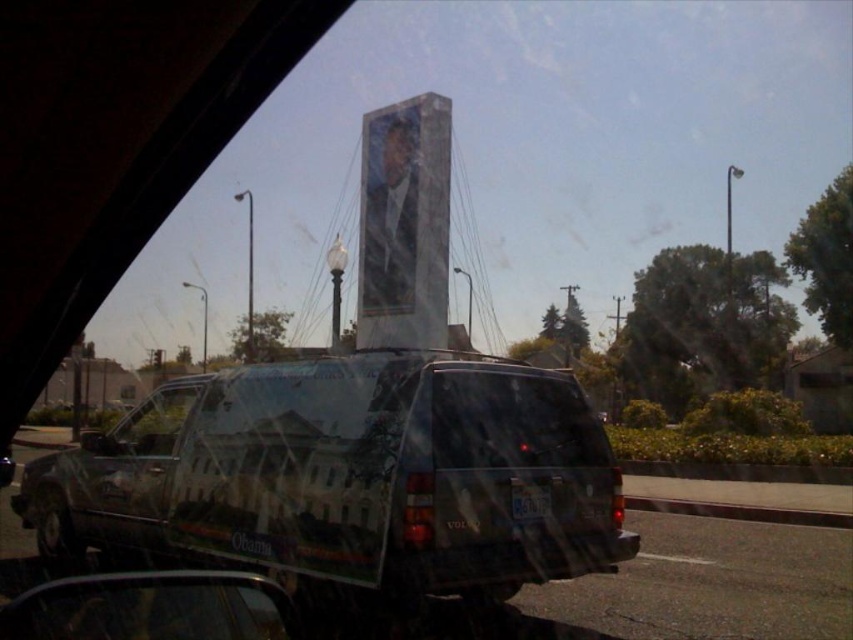
Is transparent plastic car window at center wider than white plastic license plate at center?

Yes, transparent plastic car window at center is wider than white plastic license plate at center.

Is transparent plastic car window at center to the right of white plastic license plate at center from the viewer's perspective?

No, transparent plastic car window at center is not to the right of white plastic license plate at center.

Is point (119, 436) less distant than point (515, 490)?

No, (119, 436) is behind (515, 490).

At what (x,y) coordinates should I click in order to perform the action: click on transparent plastic car window at center. Please return your answer as a coordinate pair (x, y). Looking at the image, I should click on (154, 420).

Is point (165, 452) farther from viewer compared to point (115, 449)?

No, (165, 452) is closer to viewer.

Which is more to the right, transparent plastic car window at center or metallic reflective view mirror at lower left?

Positioned to the right is metallic reflective view mirror at lower left.

Is point (183, 413) closer to viewer compared to point (80, 440)?

Yes, point (183, 413) is in front of point (80, 440).

Where is `transparent plastic car window at center`? The image size is (853, 640). transparent plastic car window at center is located at coordinates (154, 420).

Is point (585, 419) farther from camera compared to point (86, 449)?

Yes, it is.

Who is positioned more to the right, transparent plastic windshield at center or metallic reflective view mirror at lower left?

Positioned to the right is transparent plastic windshield at center.

Identify the location of transparent plastic windshield at center. This screenshot has width=853, height=640. [514, 420].

Image resolution: width=853 pixels, height=640 pixels. Identify the location of transparent plastic windshield at center. (514, 420).